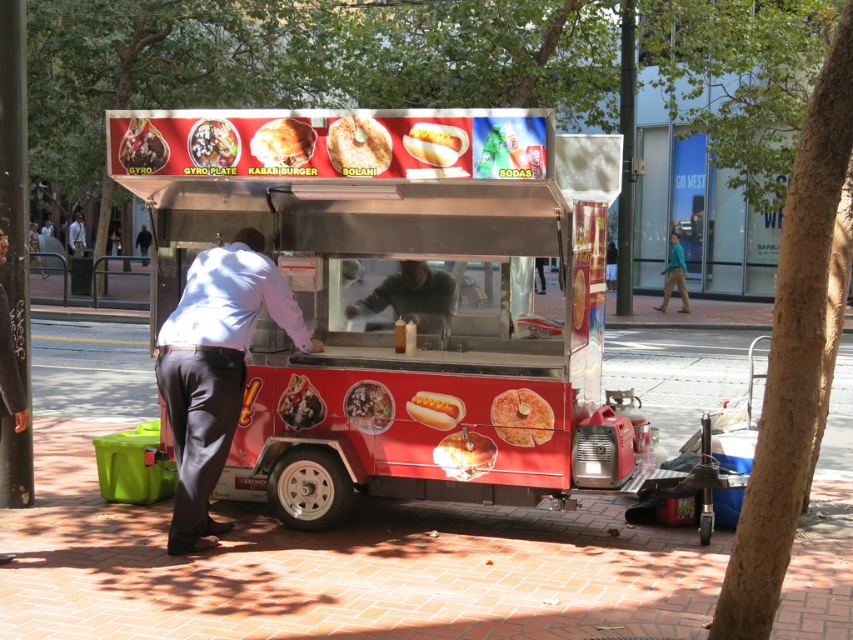
Question: Which point appears closest to the camera in this image?

Choices:
 (A) (444, 132)
 (B) (381, 428)
 (C) (79, 224)

Answer: (A)

Question: Observing the image, what is the correct spatial positioning of matte white shirt at center in reference to dark gray sweater at center?

Choices:
 (A) right
 (B) left

Answer: (B)

Question: Which point is farther from the camera taking this photo?

Choices:
 (A) (136, 168)
 (B) (508, 392)
 (C) (416, 138)
 (D) (677, 268)

Answer: (D)

Question: Which point is farther from the camera taking this photo?

Choices:
 (A) (451, 442)
 (B) (341, 166)

Answer: (A)

Question: Can you confirm if shiny red food truck at center is thinner than white shirt at center?

Choices:
 (A) yes
 (B) no

Answer: (B)

Question: Is matte brown gyro at center wider than shiny silver hot dog at center?

Choices:
 (A) yes
 (B) no

Answer: (A)